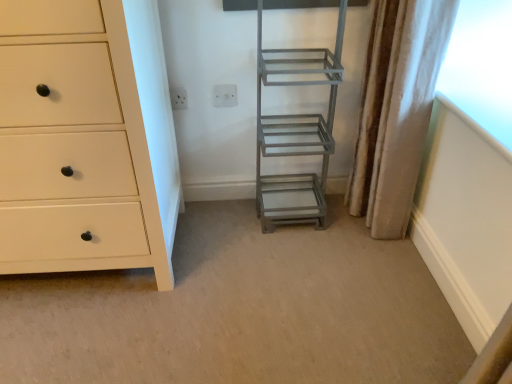
Image resolution: width=512 pixels, height=384 pixels. I want to click on vacant space to the left of metallic gray ladder at center, so click(x=229, y=217).